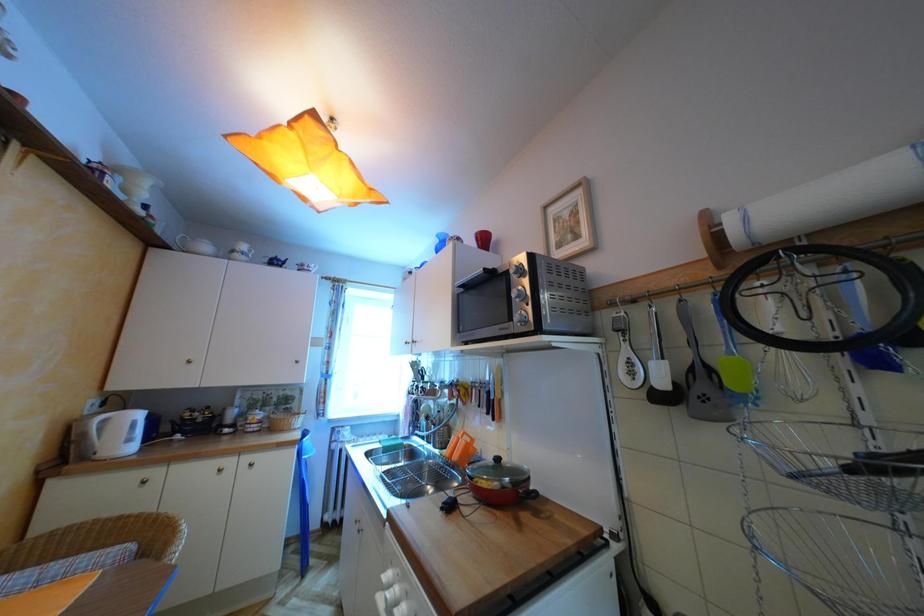
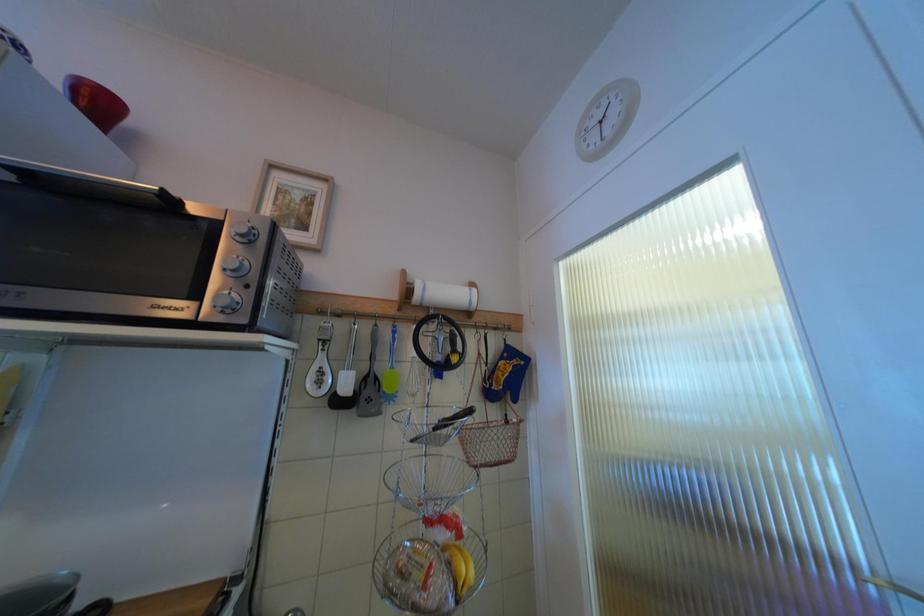
Question: How did the camera likely rotate?

Choices:
 (A) Left
 (B) Right
 (C) Up
 (D) Down

Answer: (B)